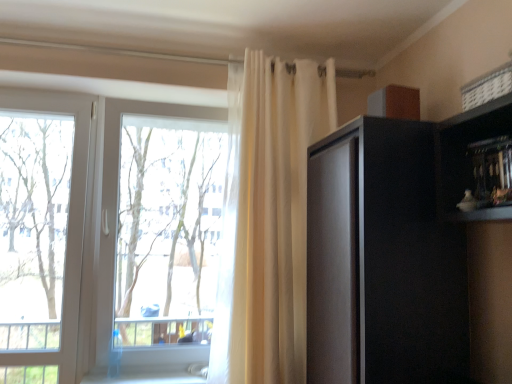
Question: From the image's perspective, would you say sheer white curtain at upper center is positioned over transparent glass window at center?

Choices:
 (A) yes
 (B) no

Answer: (A)

Question: Does sheer white curtain at upper center appear on the left side of transparent glass window at center?

Choices:
 (A) yes
 (B) no

Answer: (B)

Question: From a real-world perspective, is sheer white curtain at upper center below transparent glass window at center?

Choices:
 (A) no
 (B) yes

Answer: (A)

Question: Can you confirm if sheer white curtain at upper center is bigger than transparent glass window at center?

Choices:
 (A) no
 (B) yes

Answer: (B)

Question: Can you confirm if sheer white curtain at upper center is taller than transparent glass window at center?

Choices:
 (A) yes
 (B) no

Answer: (A)

Question: In terms of width, does sheer white curtain at upper center look wider or thinner when compared to matte black cabinet at right?

Choices:
 (A) thin
 (B) wide

Answer: (A)

Question: Does point (269, 236) appear closer or farther from the camera than point (389, 240)?

Choices:
 (A) closer
 (B) farther

Answer: (B)

Question: From the image's perspective, relative to matte black cabinet at right, is sheer white curtain at upper center above or below?

Choices:
 (A) below
 (B) above

Answer: (B)

Question: Based on their sizes in the image, would you say sheer white curtain at upper center is bigger or smaller than matte black cabinet at right?

Choices:
 (A) big
 (B) small

Answer: (A)

Question: Is sheer white curtain at upper center bigger or smaller than transparent glass tree at left?

Choices:
 (A) big
 (B) small

Answer: (A)

Question: Is sheer white curtain at upper center inside or outside of transparent glass tree at left?

Choices:
 (A) inside
 (B) outside

Answer: (B)

Question: Relative to transparent glass tree at left, is sheer white curtain at upper center in front or behind?

Choices:
 (A) behind
 (B) front

Answer: (B)

Question: Does point (286, 379) appear closer or farther from the camera than point (38, 279)?

Choices:
 (A) farther
 (B) closer

Answer: (B)

Question: Considering the positions of matte black cabinet at right and sheer white curtain at upper center in the image, is matte black cabinet at right wider or thinner than sheer white curtain at upper center?

Choices:
 (A) wide
 (B) thin

Answer: (A)

Question: Considering the positions of matte black cabinet at right and sheer white curtain at upper center in the image, is matte black cabinet at right bigger or smaller than sheer white curtain at upper center?

Choices:
 (A) small
 (B) big

Answer: (A)